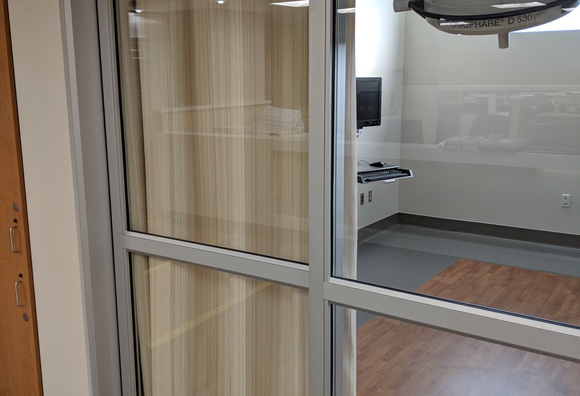
Identify the location of wired mouse. This screenshot has height=396, width=580. pyautogui.click(x=364, y=160).